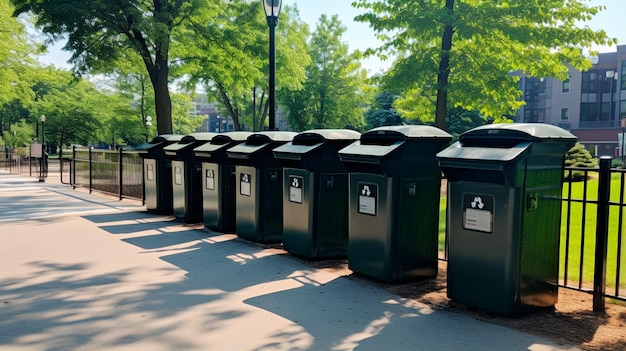
At what (x,y) coordinates should I click in order to perform the action: click on labels on the trash cans. Please return your answer as a coordinate pair (x, y). This screenshot has height=351, width=626. Looking at the image, I should click on (150, 176), (178, 177), (210, 182), (245, 188), (298, 193), (365, 205), (484, 221).